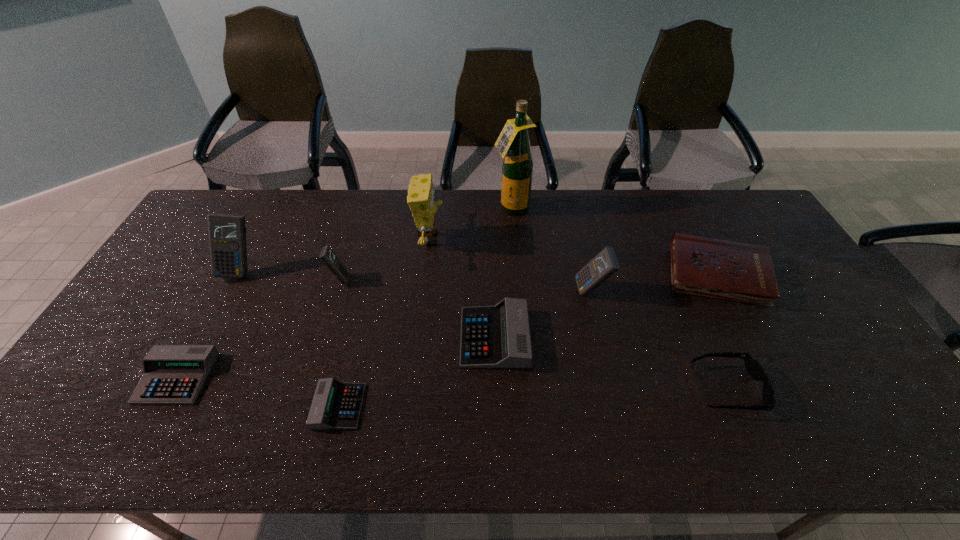
Locate an element on the screen. This screenshot has width=960, height=540. vacant space that satisfies the following two spatial constraints: 1. on the face of the biggest gray calculator; 2. on the left side of the fifth object from left to right is located at coordinates (419, 338).

The width and height of the screenshot is (960, 540). I want to click on vacant area that satisfies the following two spatial constraints: 1. on the front-facing side of the biggest blue calculator; 2. on the left side of the biggest gray calculator, so click(204, 338).